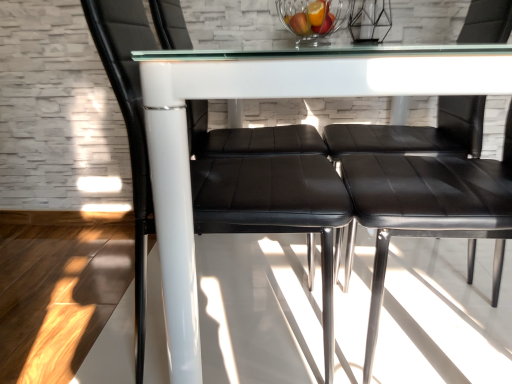
Question: From a real-world perspective, does black leather chair at left, positioned as the first chair in left-to-right order, sit lower than clear glass bowl at upper center?

Choices:
 (A) yes
 (B) no

Answer: (A)

Question: From the image's perspective, is black leather chair at left, which is the second chair in right-to-left order, located above clear glass bowl at upper center?

Choices:
 (A) no
 (B) yes

Answer: (A)

Question: Considering the relative sizes of black leather chair at left, positioned as the first chair in left-to-right order, and clear glass bowl at upper center in the image provided, is black leather chair at left, positioned as the first chair in left-to-right order, taller than clear glass bowl at upper center?

Choices:
 (A) yes
 (B) no

Answer: (A)

Question: Is clear glass bowl at upper center at the back of black leather chair at left, positioned as the first chair in left-to-right order?

Choices:
 (A) no
 (B) yes

Answer: (A)

Question: Does black leather chair at left, positioned as the first chair in left-to-right order, appear on the left side of clear glass bowl at upper center?

Choices:
 (A) no
 (B) yes

Answer: (B)

Question: Is black leather chair at left, positioned as the first chair in left-to-right order, wider than clear glass bowl at upper center?

Choices:
 (A) no
 (B) yes

Answer: (B)

Question: From a real-world perspective, is black leather chair at center, which is the 1th chair from right to left, located beneath black leather chair at left, positioned as the first chair in left-to-right order?

Choices:
 (A) yes
 (B) no

Answer: (A)

Question: Is black leather chair at center, which is the 1th chair from right to left, facing away from black leather chair at left, which is the second chair in right-to-left order?

Choices:
 (A) no
 (B) yes

Answer: (A)

Question: Is black leather chair at center, positioned as the second chair in left-to-right order, far from black leather chair at left, which is the second chair in right-to-left order?

Choices:
 (A) no
 (B) yes

Answer: (A)

Question: Does black leather chair at center, positioned as the second chair in left-to-right order, come behind black leather chair at left, positioned as the first chair in left-to-right order?

Choices:
 (A) no
 (B) yes

Answer: (A)

Question: Is black leather chair at center, positioned as the second chair in left-to-right order, surrounding black leather chair at left, positioned as the first chair in left-to-right order?

Choices:
 (A) no
 (B) yes

Answer: (A)

Question: Could you tell me if black leather chair at center, positioned as the second chair in left-to-right order, is turned towards black leather chair at left, which is the second chair in right-to-left order?

Choices:
 (A) no
 (B) yes

Answer: (B)

Question: Is transparent glass table at center positioned far away from black leather chair at left, positioned as the first chair in left-to-right order?

Choices:
 (A) yes
 (B) no

Answer: (B)